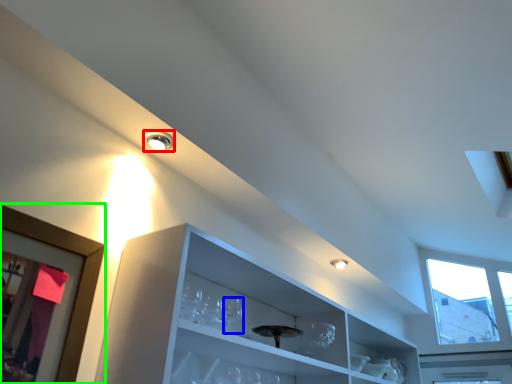
Question: Which object is positioned closest to droplight (highlighted by a red box)? Select from wine glass (highlighted by a blue box) and picture frame (highlighted by a green box).

Choices:
 (A) wine glass
 (B) picture frame

Answer: (B)